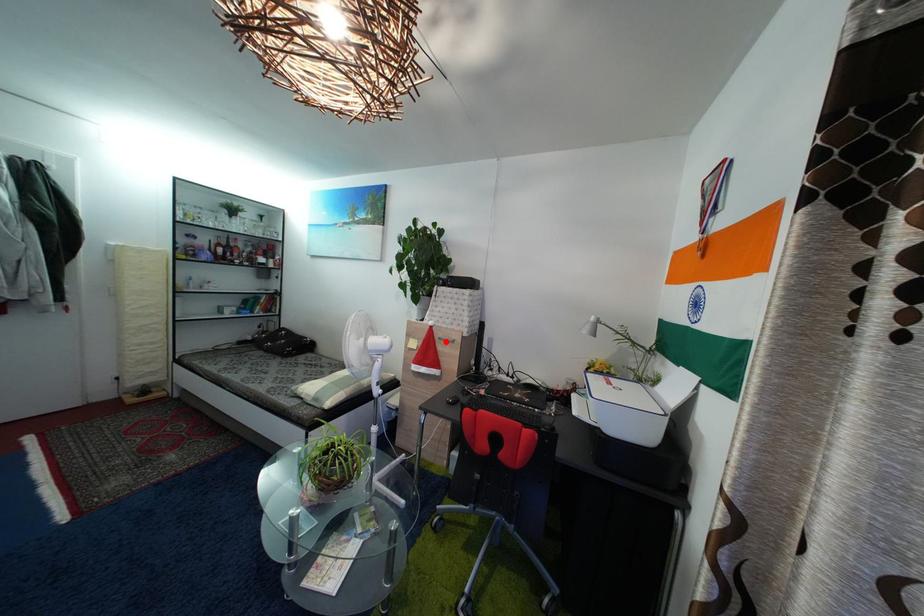
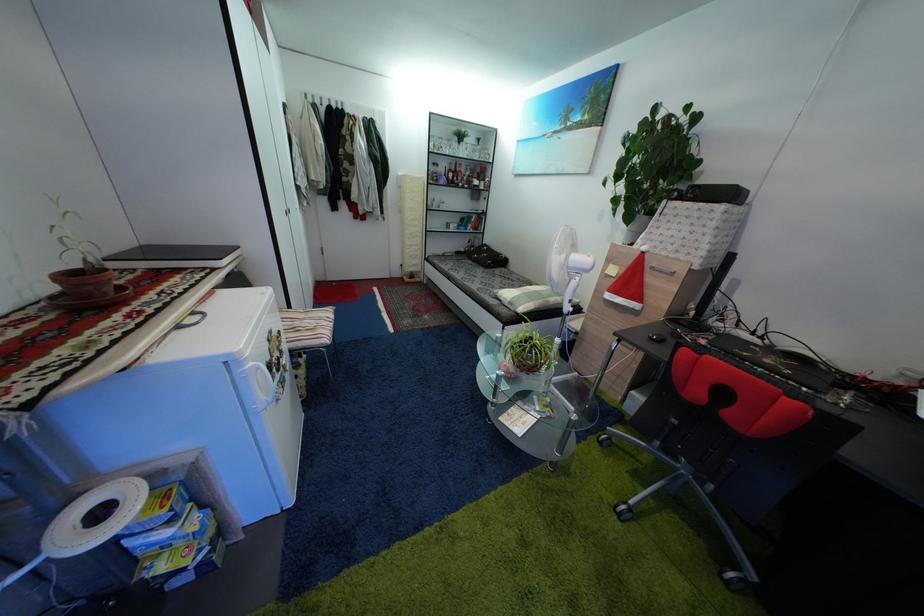
Question: I am providing you with two images of the same scene from different viewpoints. In image1, a red point is highlighted. Considering the same 3D point in image2, which of the following is correct?

Choices:
 (A) It is closer
 (B) It is farther

Answer: (A)